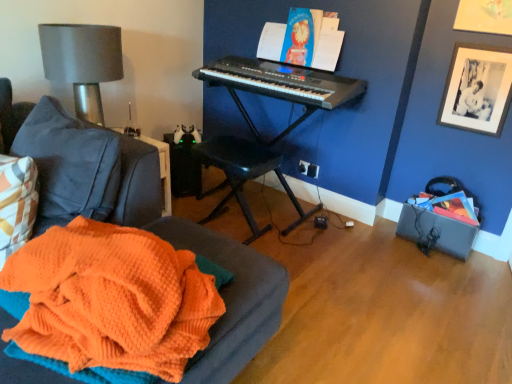
Measure the distance between point (319, 85) and camera.

Point (319, 85) and camera are 7.58 feet apart.

What do you see at coordinates (244, 176) in the screenshot? I see `black plastic music stool at center` at bounding box center [244, 176].

Based on the photo, in order to face orange knitted blanket at lower left, should I rotate leftwards or rightwards?

It's best to rotate left around 20.368 degrees.

Where is `matte gray lampshade at upper left`? The height and width of the screenshot is (384, 512). matte gray lampshade at upper left is located at coordinates (82, 62).

Where is `black plastic keyboard at center`? The width and height of the screenshot is (512, 384). black plastic keyboard at center is located at coordinates (256, 128).

From a real-world perspective, between matte gray lampshade at upper left and black plastic music stool at center, who is vertically higher?

In real-world perspective, matte gray lampshade at upper left is above.

Between matte gray lampshade at upper left and black plastic music stool at center, which one has larger width?

matte gray lampshade at upper left is wider.

Between point (79, 94) and point (238, 169), which one is positioned behind?

The point (238, 169) is farther from the camera.

Can you confirm if black plastic keyboard at upper center is bigger than black matte picture frame at upper right?

Yes.

From a real-world perspective, is black plastic keyboard at upper center above or below black matte picture frame at upper right?

From a real-world perspective, black plastic keyboard at upper center is physically below black matte picture frame at upper right.

Is black plastic keyboard at upper center thinner than black matte picture frame at upper right?

In fact, black plastic keyboard at upper center might be wider than black matte picture frame at upper right.

Based on the photo, how far apart are black plastic music stool at center and black plastic keyboard at upper center?

A distance of 21.05 inches exists between black plastic music stool at center and black plastic keyboard at upper center.

Which of these two, black plastic music stool at center or black plastic keyboard at upper center, stands shorter?

Standing shorter between the two is black plastic keyboard at upper center.

Which is in front, point (296, 200) or point (215, 78)?

The point (215, 78) is more forward.

Can you confirm if black matte picture frame at upper right is shorter than black plastic keyboard at center?

Correct, black matte picture frame at upper right is not as tall as black plastic keyboard at center.

Is black matte picture frame at upper right not within black plastic keyboard at center?

Yes, black matte picture frame at upper right is located beyond the bounds of black plastic keyboard at center.

Who is more distant, black matte picture frame at upper right or black plastic keyboard at center?

Positioned behind is black plastic keyboard at center.

Consider the image. Is black matte picture frame at upper right beside black plastic keyboard at center?

→ black matte picture frame at upper right is not next to black plastic keyboard at center, and they're not touching.

Are black plastic keyboard at upper center and orange knitted blanket at lower left located far from each other?

Indeed, black plastic keyboard at upper center is not near orange knitted blanket at lower left.

From the image's perspective, would you say black plastic keyboard at upper center is positioned over orange knitted blanket at lower left?

Yes.

Can you confirm if black plastic keyboard at upper center is wider than orange knitted blanket at lower left?

No.

Does black plastic keyboard at upper center have a lesser height compared to matte gray lampshade at upper left?

Indeed, black plastic keyboard at upper center has a lesser height compared to matte gray lampshade at upper left.

Looking at this image, how many degrees apart are the facing directions of black plastic keyboard at upper center and matte gray lampshade at upper left?

87.4 degrees.

Is black plastic keyboard at upper center positioned behind matte gray lampshade at upper left?

Yes, black plastic keyboard at upper center is behind matte gray lampshade at upper left.

From the image's perspective, is black matte picture frame at upper right below orange knitted blanket at lower left?

Actually, black matte picture frame at upper right appears above orange knitted blanket at lower left in the image.

From the picture: Is black matte picture frame at upper right completely or partially outside of orange knitted blanket at lower left?

Yes, black matte picture frame at upper right is outside of orange knitted blanket at lower left.

Between point (496, 95) and point (245, 256), which one is positioned in front?

The point (245, 256) is more forward.

You are a GUI agent. You are given a task and a screenshot of the screen. Output one action in this format:
    pyautogui.click(x=<x>, y=<y>)
    Task: Click on the picture frame behind the orange knitted blanket at lower left
    Image resolution: width=512 pixels, height=384 pixels.
    Given the screenshot: What is the action you would take?
    pyautogui.click(x=477, y=89)

The image size is (512, 384). I want to click on table lamp above the black plastic music stool at center (from the image's perspective), so click(x=82, y=62).

The image size is (512, 384). In order to click on picture frame in front of the black plastic keyboard at upper center in this screenshot , I will do `click(477, 89)`.

Which object lies further to the anchor point black plastic music stool at center, orange knitted blanket at lower left or matte blue book at upper center?

Based on the image, orange knitted blanket at lower left appears to be further to black plastic music stool at center.

Looking at the image, which one is located closer to matte blue book at upper center, black matte picture frame at upper right or black plastic keyboard at center?

black plastic keyboard at center.

Estimate the real-world distances between objects in this image. Which object is closer to matte gray lampshade at upper left, orange knitted blanket at lower left or black plastic keyboard at upper center?

Among the two, black plastic keyboard at upper center is located nearer to matte gray lampshade at upper left.

From the image, which object appears to be farther from black plastic keyboard at upper center, black matte picture frame at upper right or black plastic keyboard at center?

Based on the image, black matte picture frame at upper right appears to be further to black plastic keyboard at upper center.

From the image, which object appears to be farther from black plastic music stool at center, black plastic keyboard at upper center or black plastic keyboard at center?

Among the two, black plastic keyboard at upper center is located further to black plastic music stool at center.

From the image, which object appears to be farther from orange knitted blanket at lower left, black matte picture frame at upper right or black plastic keyboard at center?

The object further to orange knitted blanket at lower left is black matte picture frame at upper right.

Looking at the image, which one is located further to orange knitted blanket at lower left, black plastic music stool at center or black matte picture frame at upper right?

Among the two, black matte picture frame at upper right is located further to orange knitted blanket at lower left.

From the image, which object appears to be nearer to black plastic music stool at center, matte blue book at upper center or black plastic keyboard at upper center?

black plastic keyboard at upper center is positioned closer to the anchor black plastic music stool at center.

The image size is (512, 384). What are the coordinates of `musical keyboard positioned between orange knitted blanket at lower left and matte blue book at upper center from near to far` in the screenshot? It's located at (282, 82).

Locate an element on the screen. music stool situated between matte gray lampshade at upper left and black plastic keyboard at upper center from left to right is located at coordinates (244, 176).

The height and width of the screenshot is (384, 512). Find the location of `piano between black plastic music stool at center and black matte picture frame at upper right in the horizontal direction`. piano between black plastic music stool at center and black matte picture frame at upper right in the horizontal direction is located at coordinates (256, 128).

Where is `musical keyboard between black plastic music stool at center and black matte picture frame at upper right from left to right`? musical keyboard between black plastic music stool at center and black matte picture frame at upper right from left to right is located at coordinates (282, 82).